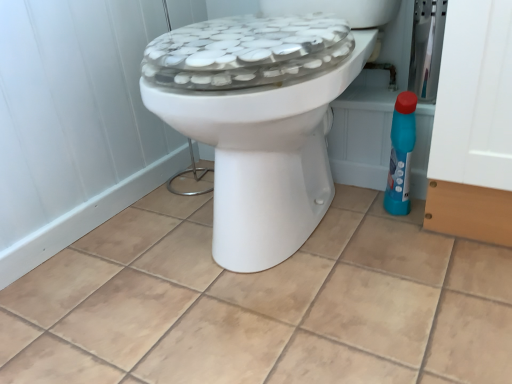
Question: Is blue plastic bottle at right smaller than white glossy toilet at center?

Choices:
 (A) yes
 (B) no

Answer: (A)

Question: Considering the relative sizes of blue plastic bottle at right and white glossy toilet at center in the image provided, is blue plastic bottle at right taller than white glossy toilet at center?

Choices:
 (A) yes
 (B) no

Answer: (B)

Question: Is blue plastic bottle at right to the left of white glossy toilet at center from the viewer's perspective?

Choices:
 (A) no
 (B) yes

Answer: (A)

Question: Is blue plastic bottle at right looking in the opposite direction of white glossy toilet at center?

Choices:
 (A) yes
 (B) no

Answer: (B)

Question: Is blue plastic bottle at right to the right of white glossy toilet at center from the viewer's perspective?

Choices:
 (A) no
 (B) yes

Answer: (B)

Question: Does point (178, 81) appear closer or farther from the camera than point (392, 122)?

Choices:
 (A) closer
 (B) farther

Answer: (A)

Question: Is white glossy toilet at center wider or thinner than blue plastic bottle at right?

Choices:
 (A) thin
 (B) wide

Answer: (B)

Question: From their relative heights in the image, would you say white glossy toilet at center is taller or shorter than blue plastic bottle at right?

Choices:
 (A) tall
 (B) short

Answer: (A)

Question: Is white glossy toilet at center bigger or smaller than blue plastic bottle at right?

Choices:
 (A) small
 (B) big

Answer: (B)

Question: Is white glossy toilet at center taller or shorter than beige ceramic tile at center?

Choices:
 (A) tall
 (B) short

Answer: (A)

Question: Is point (198, 102) closer or farther from the camera than point (440, 304)?

Choices:
 (A) farther
 (B) closer

Answer: (B)

Question: Looking at their shapes, would you say white glossy toilet at center is wider or thinner than beige ceramic tile at center?

Choices:
 (A) thin
 (B) wide

Answer: (A)

Question: Would you say white glossy toilet at center is to the left or to the right of beige ceramic tile at center in the picture?

Choices:
 (A) right
 (B) left

Answer: (A)

Question: Is blue plastic bottle at right in front of or behind white glossy toilet at center in the image?

Choices:
 (A) behind
 (B) front

Answer: (A)

Question: Considering the positions of blue plastic bottle at right and white glossy toilet at center in the image, is blue plastic bottle at right taller or shorter than white glossy toilet at center?

Choices:
 (A) tall
 (B) short

Answer: (B)